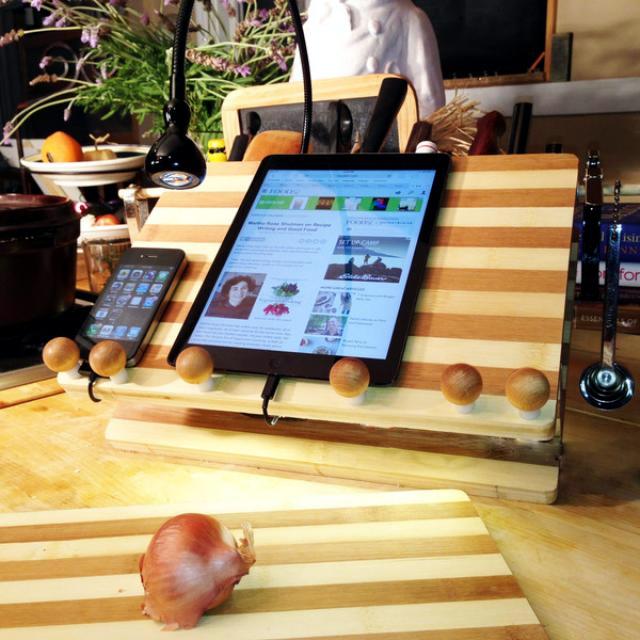
This screenshot has width=640, height=640. Identify the location of cable. (255, 403).